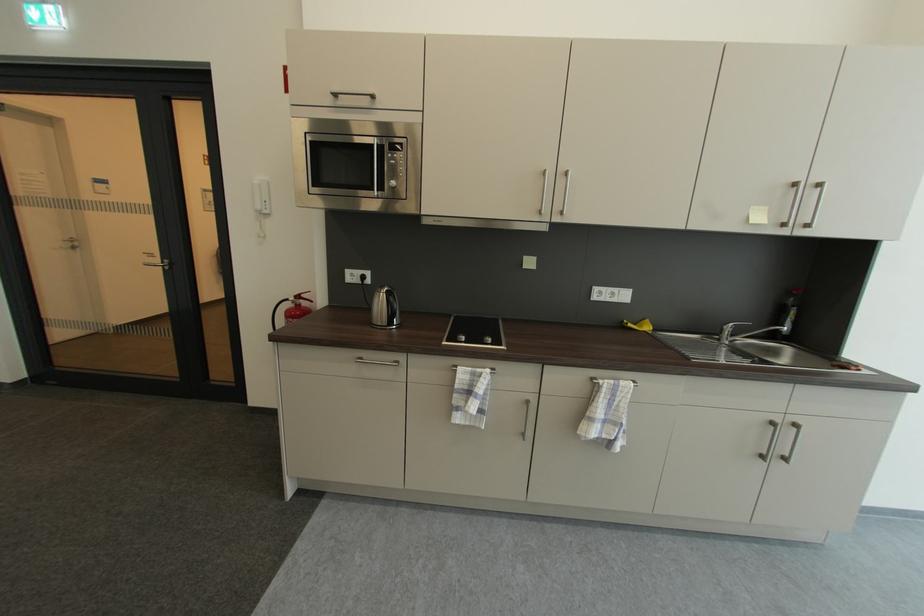
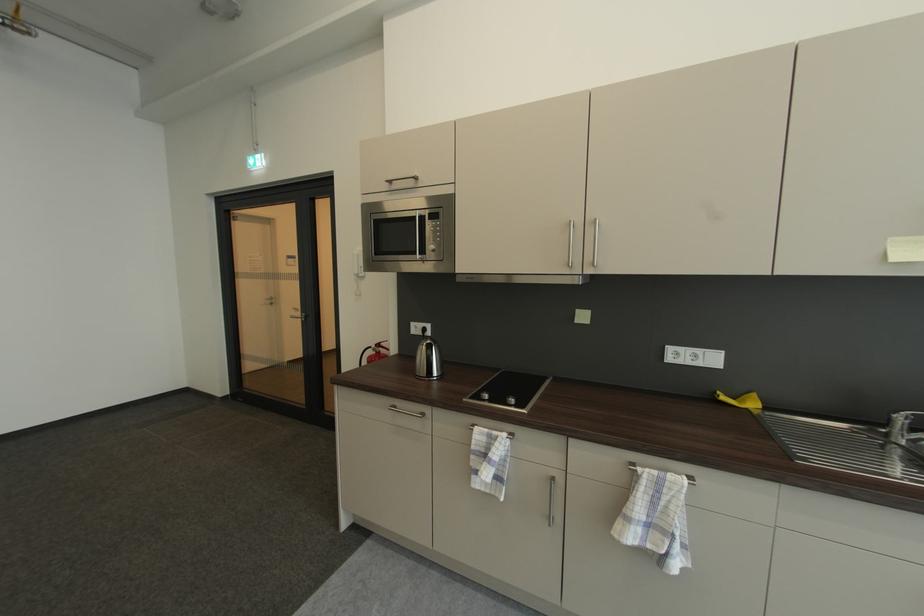
Question: The images are taken continuously from a first-person perspective. In which direction are you moving?

Choices:
 (A) Left
 (B) Right
 (C) Forward
 (D) Backward

Answer: (B)